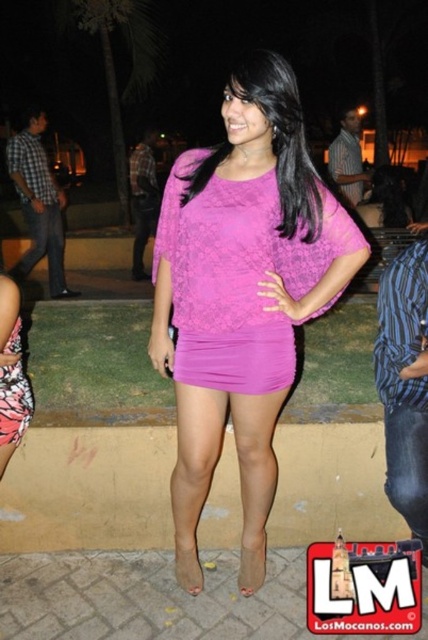
Can you confirm if blue striped shirt at right is bigger than matte pink blouse at center?

Incorrect, blue striped shirt at right is not larger than matte pink blouse at center.

Between point (424, 529) and point (279, 189), which one is positioned in front?

Point (279, 189) is in front.

Who is more forward, (424, 260) or (270, 128)?

Point (270, 128) is more forward.

You are a GUI agent. You are given a task and a screenshot of the screen. Output one action in this format:
    pyautogui.click(x=<x>, y=<y>)
    Task: Click on the blue striped shirt at right
    The image size is (428, 640).
    Given the screenshot: What is the action you would take?
    pyautogui.click(x=404, y=385)

Who is more distant from viewer, [294,144] or [403,392]?

Positioned behind is point [403,392].

Who is positioned more to the right, pink lace top at center or blue striped shirt at right?

From the viewer's perspective, blue striped shirt at right appears more on the right side.

Which is in front, point (234, 326) or point (388, 323)?

Positioned in front is point (234, 326).

You are a GUI agent. You are given a task and a screenshot of the screen. Output one action in this format:
    pyautogui.click(x=<x>, y=<y>)
    Task: Click on the pink lace top at center
    
    Given the screenshot: What is the action you would take?
    pyautogui.click(x=241, y=294)

Between point (365, 253) and point (186, 374), which one is positioned behind?

Positioned behind is point (186, 374).

Does pink lace top at center have a greater height compared to lace-like purple dress at center?

Yes.

Identify the location of pink lace top at center. This screenshot has width=428, height=640. (241, 294).

Identify the location of pink lace top at center. (241, 294).